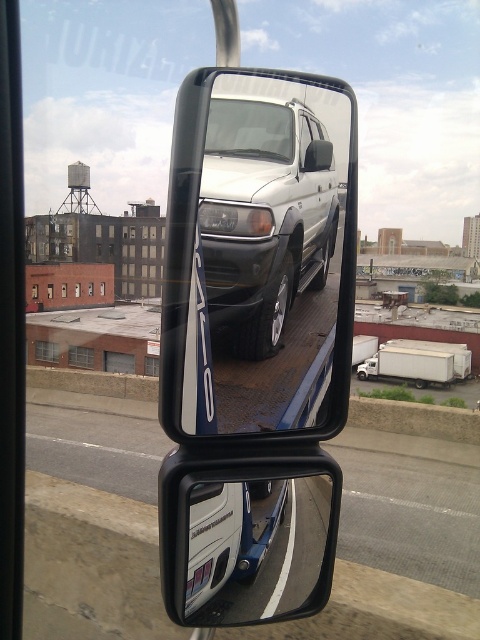
Who is positioned more to the left, satin silver suv at center or white plastic license plate at lower center?

Positioned to the left is white plastic license plate at lower center.

The image size is (480, 640). Describe the element at coordinates (264, 216) in the screenshot. I see `satin silver suv at center` at that location.

Measure the distance between point (272,104) and camera.

Point (272,104) is 4.76 feet away from camera.

The width and height of the screenshot is (480, 640). I want to click on satin silver suv at center, so click(264, 216).

Is satin silver suv at center thinner than glossy metallic van at lower right?

Correct, satin silver suv at center's width is less than glossy metallic van at lower right's.

Is satin silver suv at center shorter than glossy metallic van at lower right?

In fact, satin silver suv at center may be taller than glossy metallic van at lower right.

Is point (237, 292) less distant than point (285, 554)?

Yes, it is.

The width and height of the screenshot is (480, 640). I want to click on satin silver suv at center, so click(x=264, y=216).

Is glossy metallic van at lower right wider than white plastic license plate at lower center?

Yes, glossy metallic van at lower right is wider than white plastic license plate at lower center.

Can you confirm if glossy metallic van at lower right is smaller than white plastic license plate at lower center?

Incorrect, glossy metallic van at lower right is not smaller in size than white plastic license plate at lower center.

Who is more forward, (240, 531) or (212, 557)?

Point (212, 557) is in front.

Identify the location of glossy metallic van at lower right. Image resolution: width=480 pixels, height=640 pixels. (254, 547).